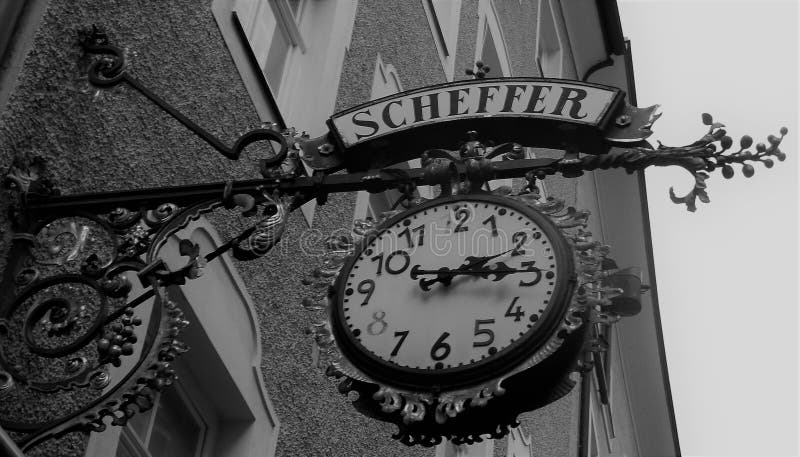
Where is `clock`? The width and height of the screenshot is (800, 457). clock is located at coordinates (446, 319).